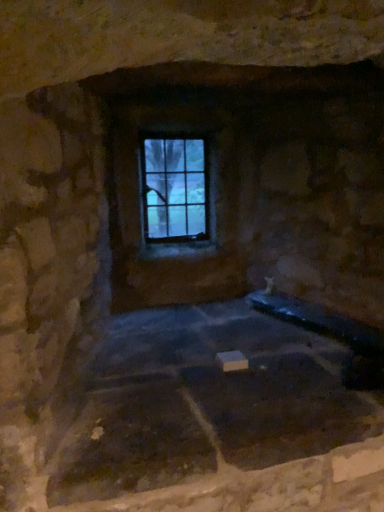
What do you see at coordinates (176, 189) in the screenshot? This screenshot has height=512, width=384. I see `clear glass window at center` at bounding box center [176, 189].

Where is `clear glass window at center`? The width and height of the screenshot is (384, 512). clear glass window at center is located at coordinates (176, 189).

The image size is (384, 512). Identify the location of clear glass window at center. (176, 189).